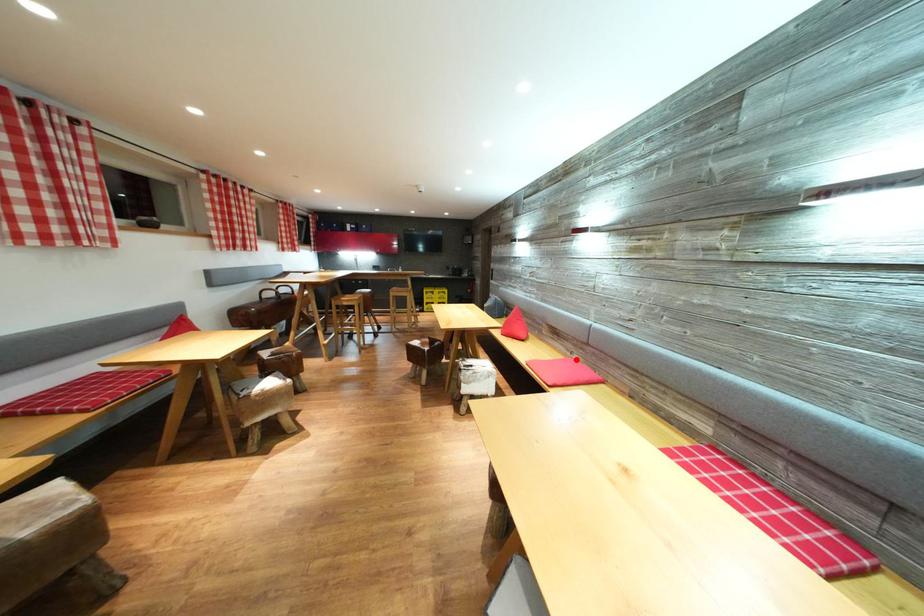
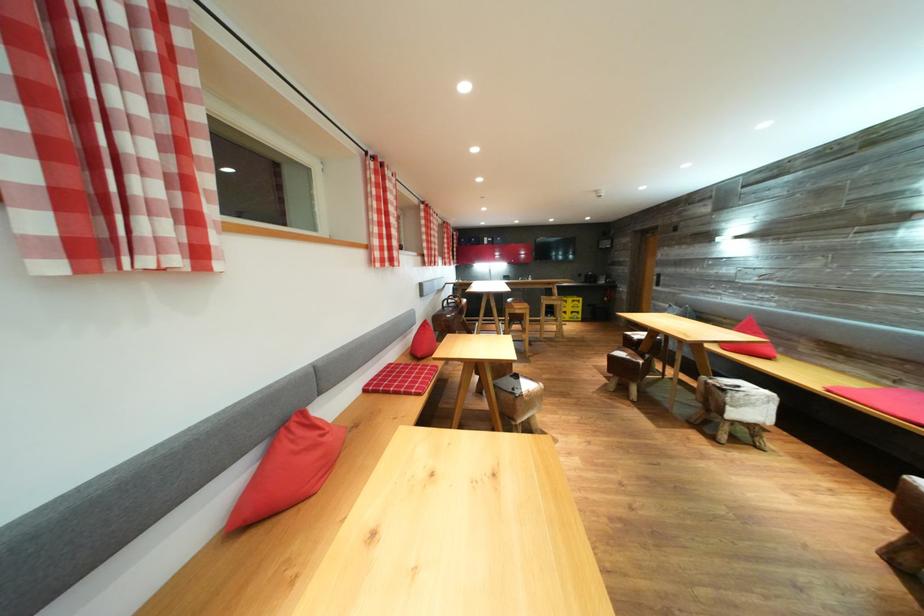
Question: I am providing you with two images of the same scene from different viewpoints. Image1 has a red point marked. In image2, the corresponding 3D location appears at what relative position? Reply with the corresponding letter.

Choices:
 (A) Closer
 (B) Farther

Answer: (B)